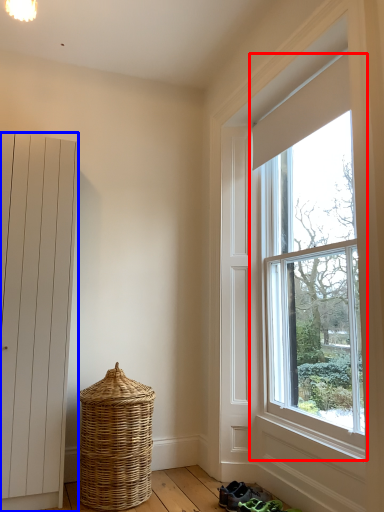
Question: Among these objects, which one is nearest to the camera, window (highlighted by a red box) or door (highlighted by a blue box)?

Choices:
 (A) window
 (B) door

Answer: (A)